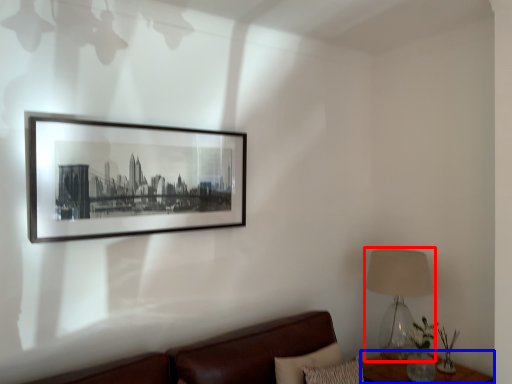
Question: Which of the following is the farthest to the observer, table lamp (highlighted by a red box) or table (highlighted by a blue box)?

Choices:
 (A) table lamp
 (B) table

Answer: (A)